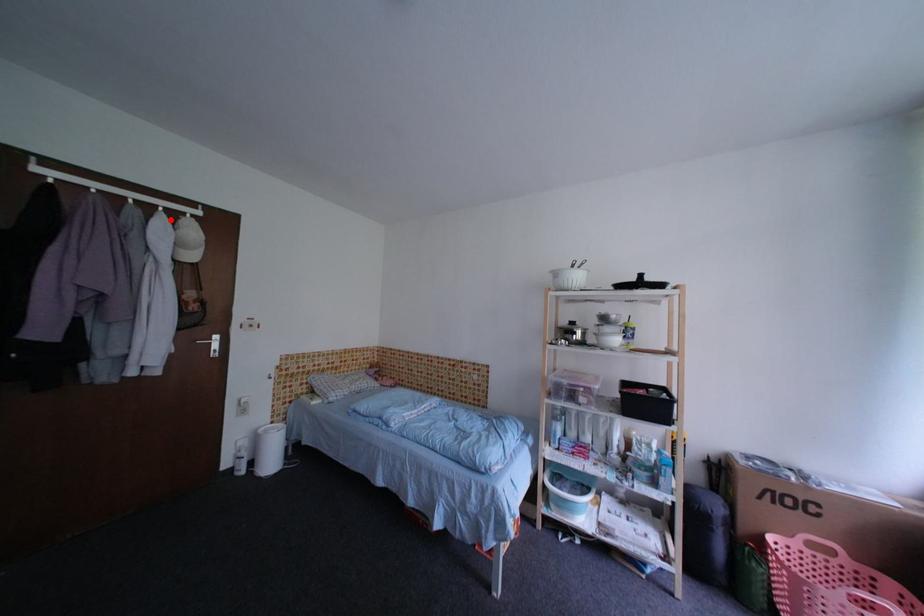
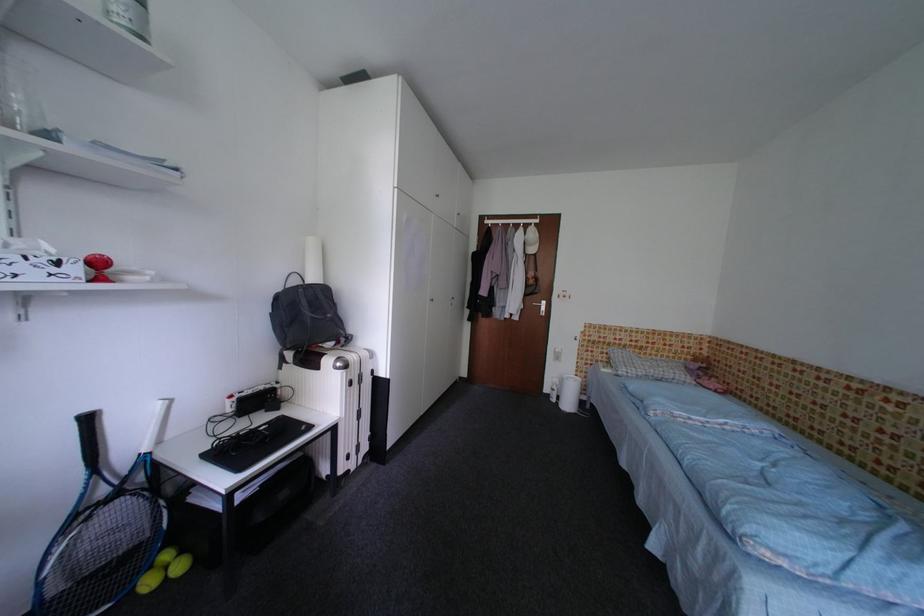
The point at the highlighted location is marked in the first image. Where is the corresponding point in the second image?

(529, 232)